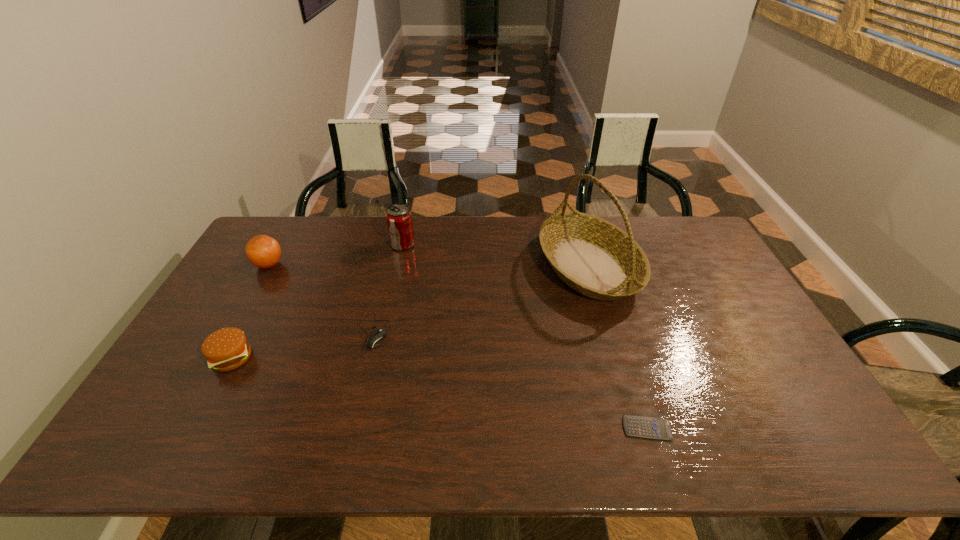
The height and width of the screenshot is (540, 960). Find the location of `vacant space positioned on the right of the hamburger`. vacant space positioned on the right of the hamburger is located at coordinates (310, 358).

Identify the location of free space located 0.380m on the right of the second shortest object. Image resolution: width=960 pixels, height=540 pixels. (521, 331).

Where is `vacant space situated on the right of the calculator`? Image resolution: width=960 pixels, height=540 pixels. vacant space situated on the right of the calculator is located at coordinates (815, 428).

Locate an element on the screen. basket situated at the far edge is located at coordinates (594, 257).

Image resolution: width=960 pixels, height=540 pixels. Identify the location of pop soda that is at the far edge. tap(399, 220).

This screenshot has width=960, height=540. Find the location of `orange that is at the far edge`. orange that is at the far edge is located at coordinates (264, 252).

Locate an element on the screen. This screenshot has width=960, height=540. object that is at the near edge is located at coordinates point(645,427).

Locate an element on the screen. orange that is positioned at the left edge is located at coordinates (264, 252).

You are a GUI agent. You are given a task and a screenshot of the screen. Output one action in this format:
    pyautogui.click(x=<x>, y=<y>)
    Task: Click on the hamburger located in the left edge section of the desktop
    The width and height of the screenshot is (960, 540).
    Given the screenshot: What is the action you would take?
    pyautogui.click(x=226, y=349)

At what (x,y) coordinates should I click in order to perform the action: click on object present at the far left corner. Please return your answer as a coordinate pair (x, y). The width and height of the screenshot is (960, 540). Looking at the image, I should click on (264, 252).